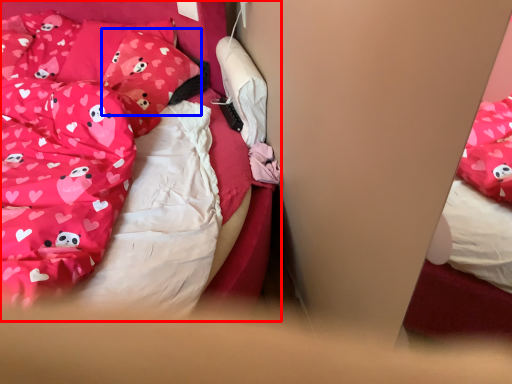
Question: Which object appears closest to the camera in this image, bed (highlighted by a red box) or pillow (highlighted by a blue box)?

Choices:
 (A) bed
 (B) pillow

Answer: (A)